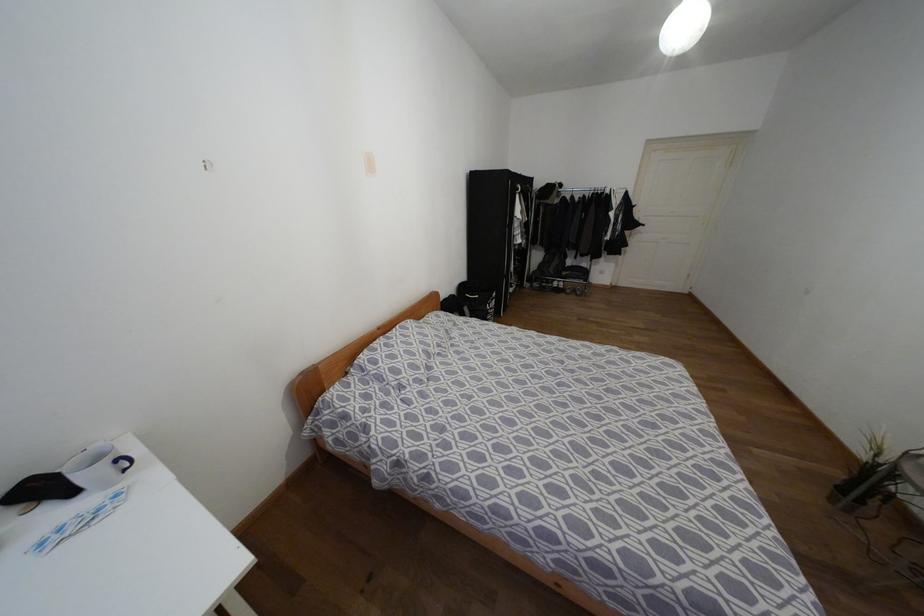
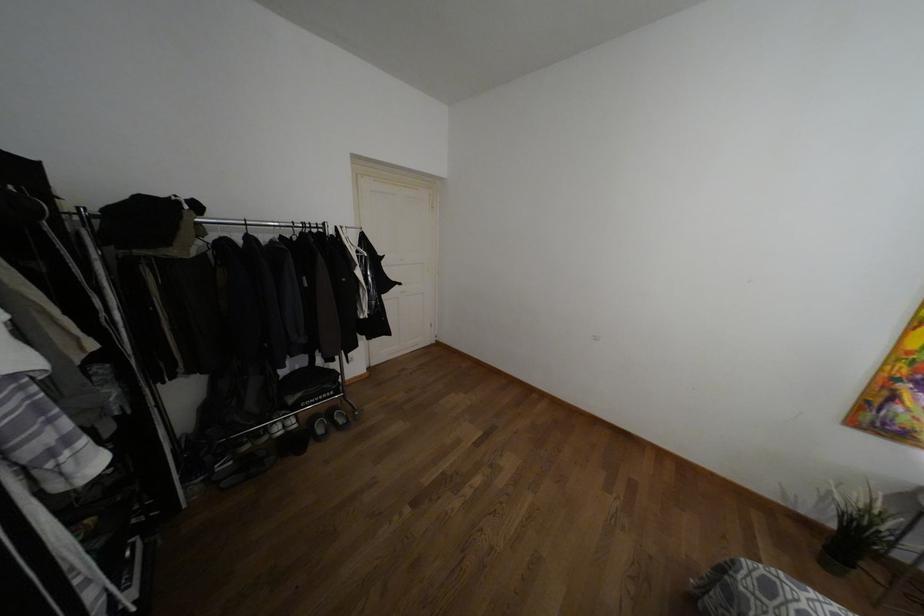
Where in the second image is the point corresponding to the point at 563,273 from the first image?

(290, 399)